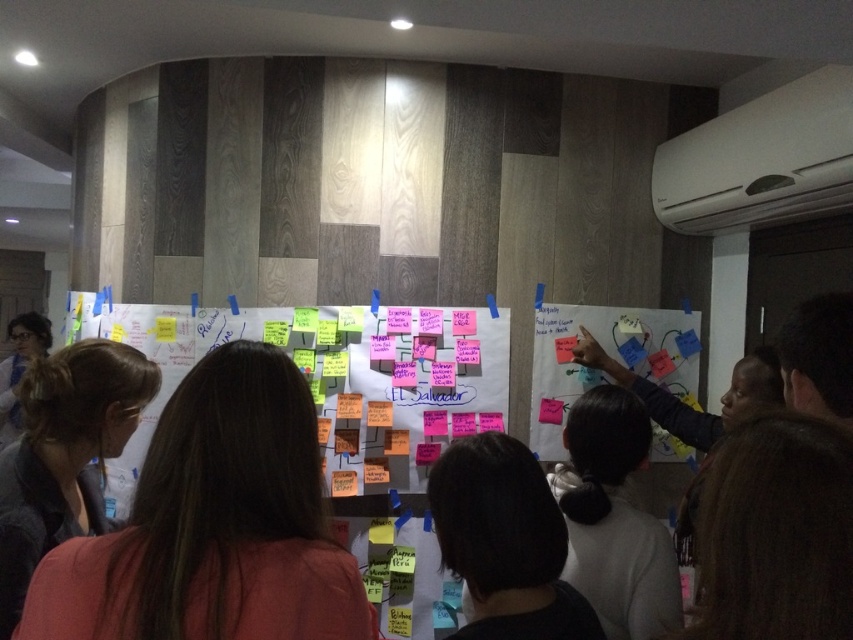
Question: Does brown hair at center have a smaller size compared to pink sticky notes at center?

Choices:
 (A) yes
 (B) no

Answer: (A)

Question: Estimate the real-world distances between objects in this image. Which object is closer to the pink sticky notes at center?

Choices:
 (A) dark brown hair at center
 (B) black hair at center
 (C) multicolored sticky notes at center

Answer: (C)

Question: Estimate the real-world distances between objects in this image. Which object is farther from the dark brown hair at left?

Choices:
 (A) black hair at center
 (B) dark brown hair at center
 (C) brown hair at center
 (D) pink sticky notes at center

Answer: (D)

Question: Does brown hair at center have a smaller size compared to black hair at center?

Choices:
 (A) yes
 (B) no

Answer: (B)

Question: Which object is farther from the camera taking this photo?

Choices:
 (A) black hair at center
 (B) dark brown hair at center
 (C) multicolored sticky notes at center

Answer: (C)

Question: Is dark brown hair at left bigger than black hair at center?

Choices:
 (A) yes
 (B) no

Answer: (A)